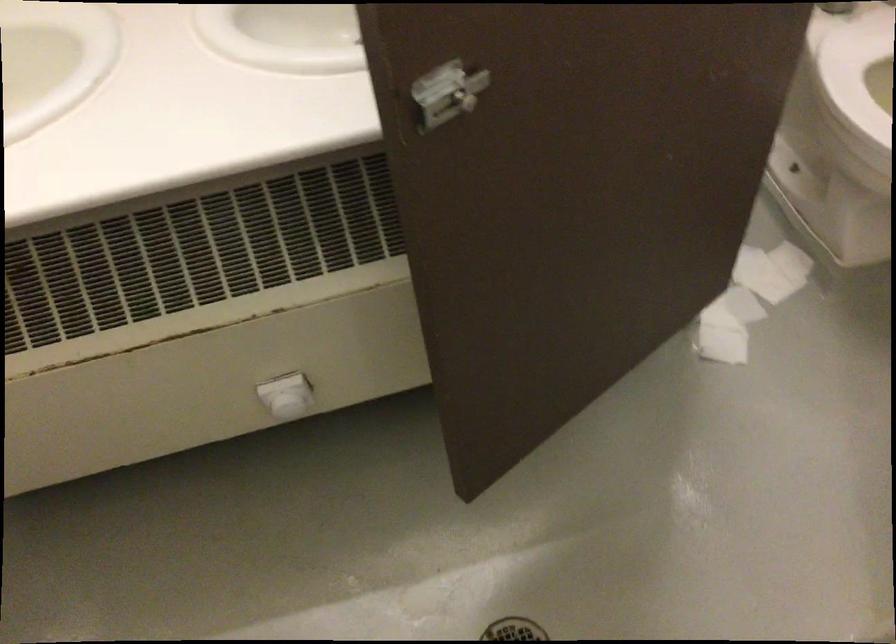
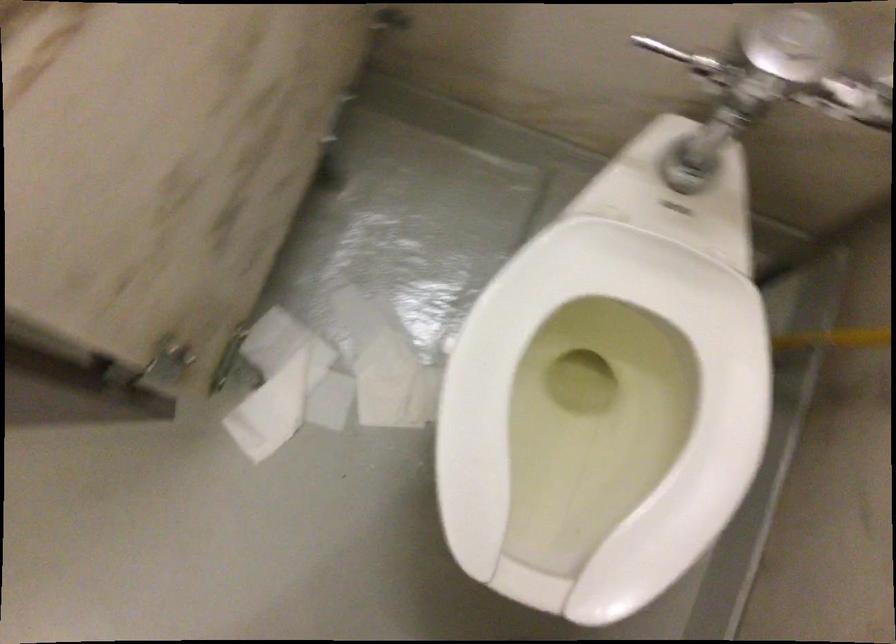
Where in the second image is the point corresponding to [660,341] from the first image?

(185, 393)